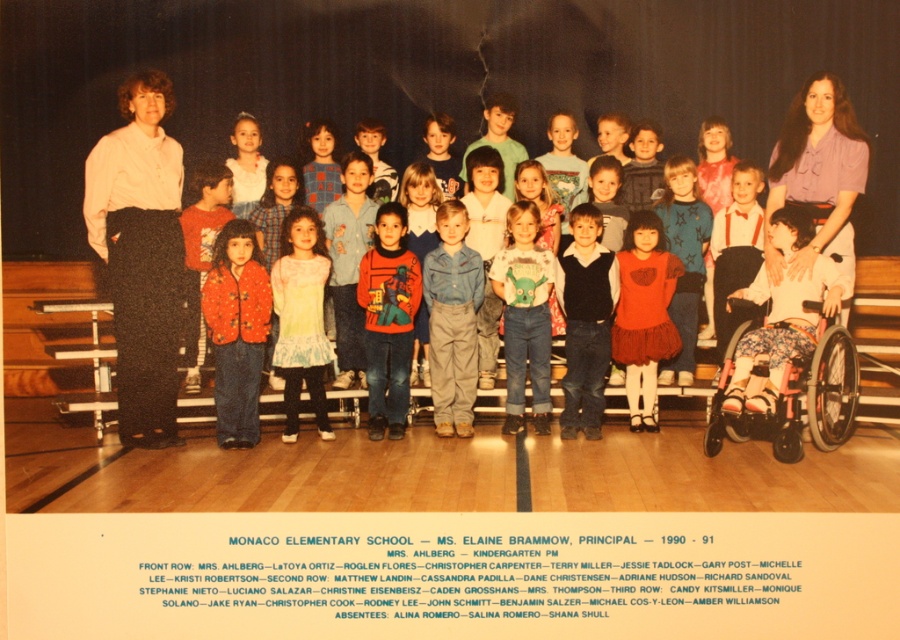
You are a photographer trying to capture a clear shot of the white shirt at upper left and the floral fabric wheelchair at lower right. Which object is closer to the camera?

The white shirt at upper left is closer to the camera because the floral fabric wheelchair at lower right is behind it.

You are a photographer adjusting the lighting for the group photo. You notice the white shirt at upper left and the floral fabric wheelchair at lower right. Which object should you focus on first to ensure proper exposure, considering their sizes?

The white shirt at upper left should be focused on first because it is larger in size than the floral fabric wheelchair at lower right, making it more prominent in the frame.